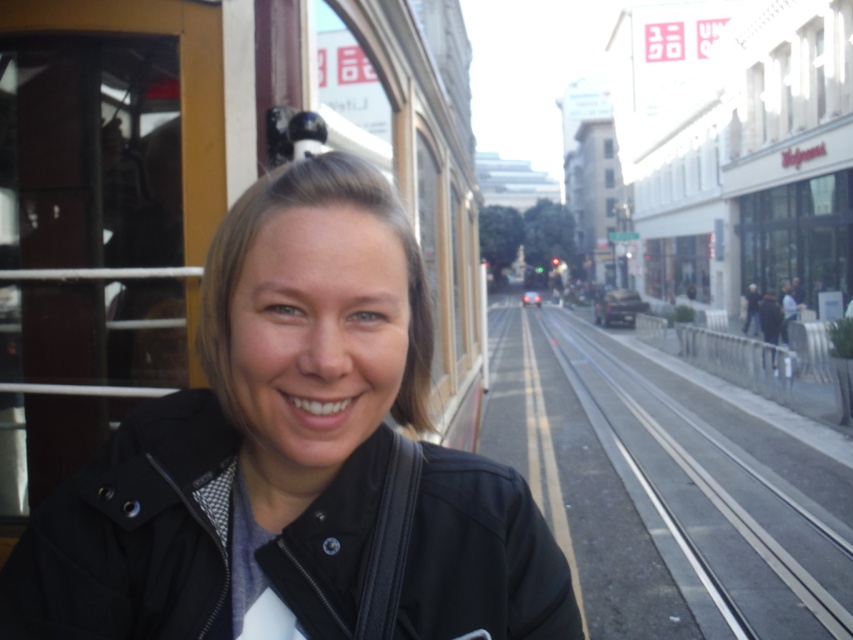
Which is behind, point (291, 189) or point (732, 576)?

The point (732, 576) is more distant.

Does black matte jacket at left have a greater width compared to metal train track at center?

No.

Does point (155, 596) lie behind point (738, 412)?

No, (155, 596) is in front of (738, 412).

Identify the location of black matte jacket at left. (251, 435).